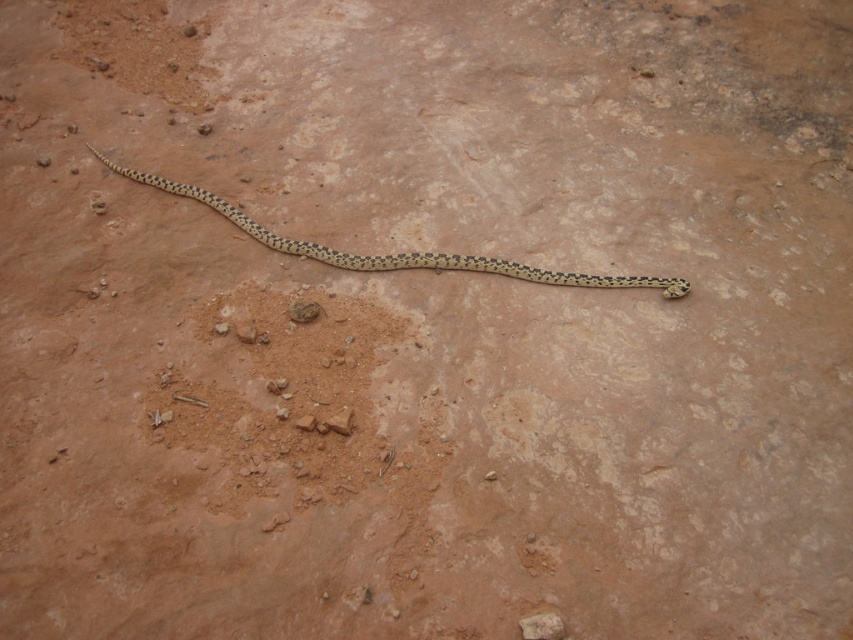
Is speckled skin snake at center further to camera compared to brown rough rock at center?

Yes, it is behind brown rough rock at center.

Which of these two, speckled skin snake at center or brown rough rock at center, stands shorter?

Standing shorter between the two is brown rough rock at center.

Where is `speckled skin snake at center`? This screenshot has height=640, width=853. speckled skin snake at center is located at coordinates (393, 253).